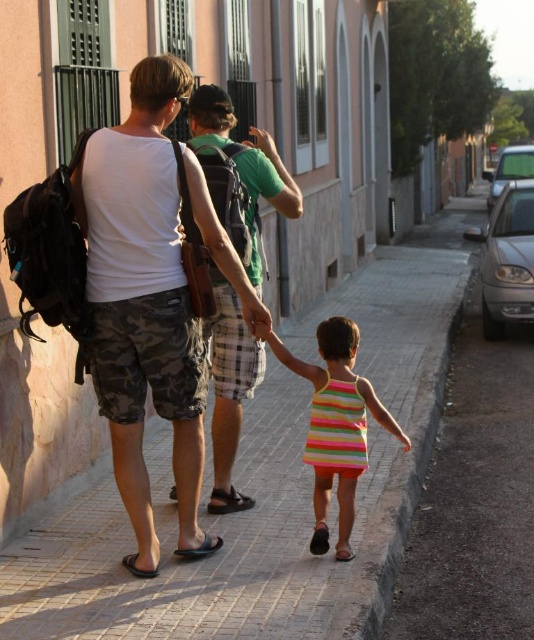
Does white matte tank top at center have a greater height compared to black leather sandal at lower center?

Indeed, white matte tank top at center has a greater height compared to black leather sandal at lower center.

Can you confirm if white matte tank top at center is positioned to the right of black leather sandal at lower center?

No, white matte tank top at center is not to the right of black leather sandal at lower center.

This screenshot has width=534, height=640. In order to click on white matte tank top at center in this screenshot , I will do `click(144, 300)`.

Does camouflage shorts at center have a greater height compared to black rubber sandal at lower left?

Indeed, camouflage shorts at center has a greater height compared to black rubber sandal at lower left.

How much distance is there between camouflage shorts at center and black rubber sandal at lower left?

camouflage shorts at center and black rubber sandal at lower left are 1.64 meters apart from each other.

You are a GUI agent. You are given a task and a screenshot of the screen. Output one action in this format:
    pyautogui.click(x=<x>, y=<y>)
    Task: Click on the camouflage shorts at center
    This screenshot has height=640, width=534.
    Given the screenshot: What is the action you would take?
    pyautogui.click(x=230, y=376)

Does point (262, 141) lie behind point (341, 460)?

That is True.

Identify the location of camouflage shorts at center. (230, 376).